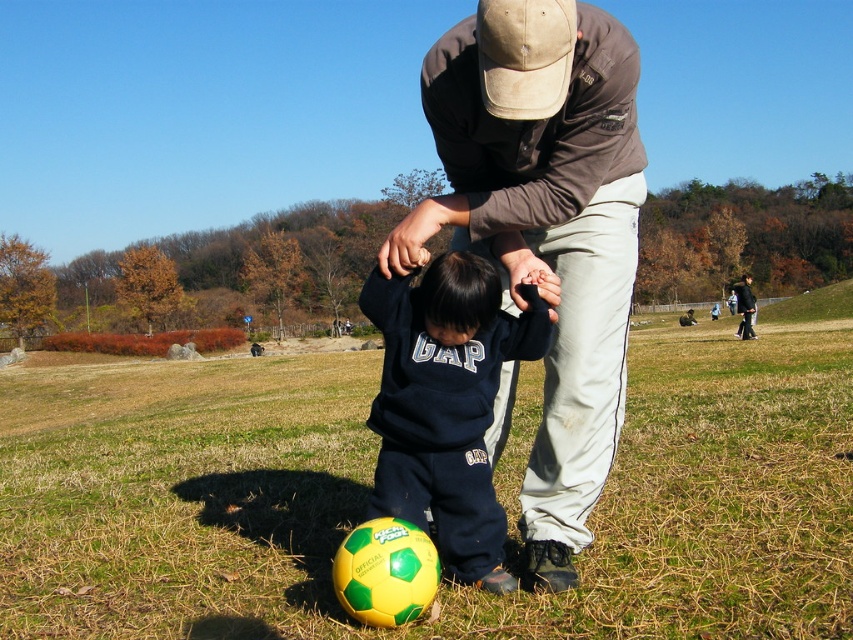
Question: Is dark blue fleece at center thinner than dark blue sweater at lower center?

Choices:
 (A) yes
 (B) no

Answer: (A)

Question: Is brown cotton shirt at center above dark blue sweater at lower center?

Choices:
 (A) yes
 (B) no

Answer: (B)

Question: Which point is farther to the camera?

Choices:
 (A) dark blue sweater at lower center
 (B) brown cotton shirt at center

Answer: (A)

Question: Which of the following is the closest to the observer?

Choices:
 (A) (740, 312)
 (B) (430, 296)
 (C) (554, 54)

Answer: (C)

Question: Which object appears farthest from the camera in this image?

Choices:
 (A) dark blue sweater at lower center
 (B) dark blue fleece at center

Answer: (A)

Question: Does brown cotton shirt at center appear under dark blue fleece at center?

Choices:
 (A) no
 (B) yes

Answer: (B)